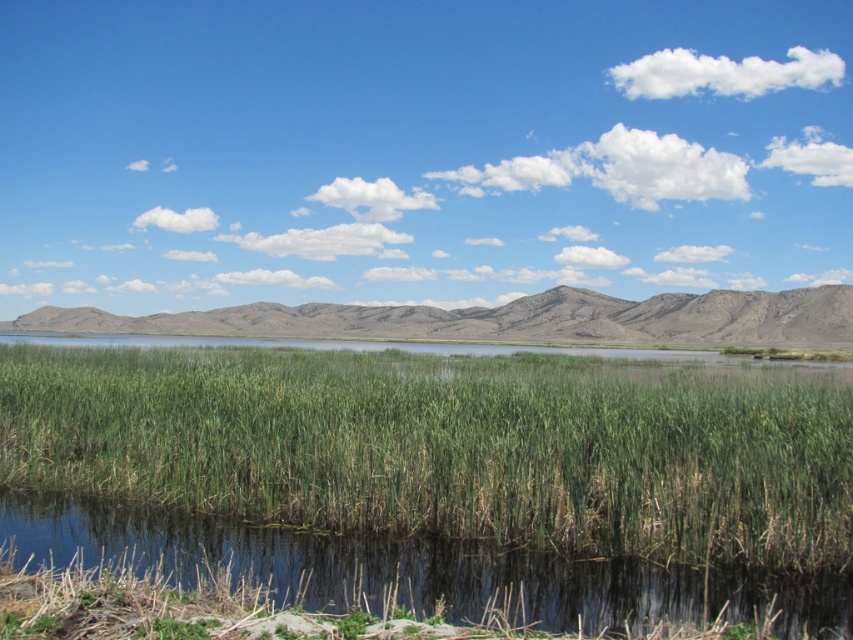
You are standing at the point marked as point (445,448) in the image. Looking around, you see green grass at lower center. What is the immediate terrain beneath your feet?

The immediate terrain beneath your feet is green grass at lower center, as the point (445,448) is located on it.

Looking at this image, you are standing at the edge of the green grassy pond at lower center and want to step onto the green grass at lower center. Based on the scene description, which area is taller, making it easier to step onto?

The green grass at lower center has a greater height compared to the green grassy pond at lower center, so stepping onto the green grass at lower center would be easier as it is elevated.